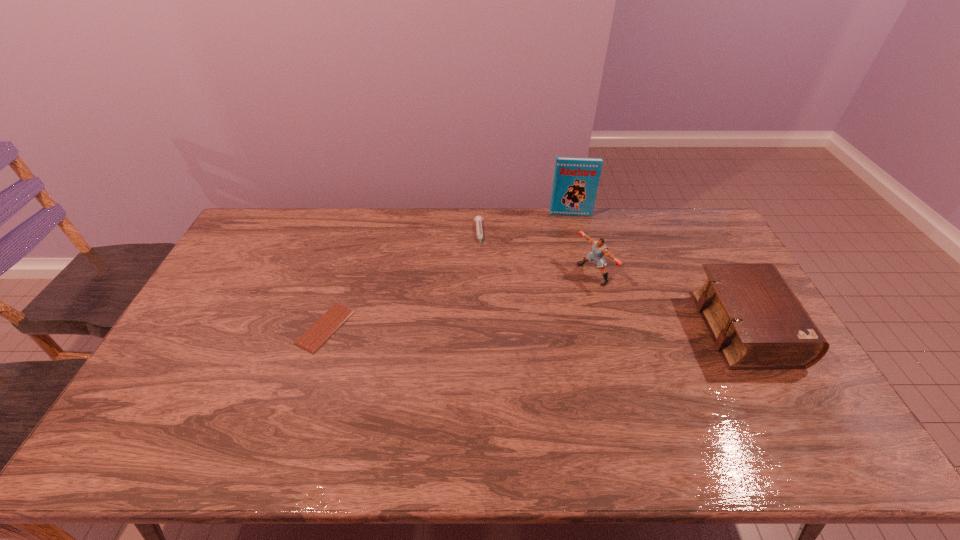
Find the location of a particular element. This screenshot has height=540, width=960. unoccupied position between the third nearest object and the chocolate bar is located at coordinates (459, 300).

This screenshot has width=960, height=540. What are the coordinates of `free spot between the farthest object and the leftmost object` in the screenshot? It's located at (448, 271).

Where is `free spot between the puncher and the tallest object`? free spot between the puncher and the tallest object is located at coordinates (582, 244).

You are a GUI agent. You are given a task and a screenshot of the screen. Output one action in this format:
    pyautogui.click(x=<x>, y=<y>)
    Task: Click on the vacant area between the second shortest object and the shortest object
    The width and height of the screenshot is (960, 540).
    Given the screenshot: What is the action you would take?
    pyautogui.click(x=402, y=281)

Where is `free space between the shortest object and the puncher`? free space between the shortest object and the puncher is located at coordinates (459, 300).

Locate an element on the screen. This screenshot has height=540, width=960. free space between the farthest object and the shortest object is located at coordinates (448, 271).

Locate an element on the screen. This screenshot has width=960, height=540. object that stands as the closest to the shortest object is located at coordinates (478, 219).

Locate an element on the screen. This screenshot has width=960, height=540. the third closest object to the fourth tallest object is located at coordinates (335, 317).

Identify the location of vacant space that satisfies the following two spatial constraints: 1. on the front side of the Bible; 2. on the spine side of the shortest object. This screenshot has width=960, height=540. (325, 328).

The width and height of the screenshot is (960, 540). I want to click on free space that satisfies the following two spatial constraints: 1. on the front side of the third farthest object; 2. on the spine side of the third tallest object, so click(608, 328).